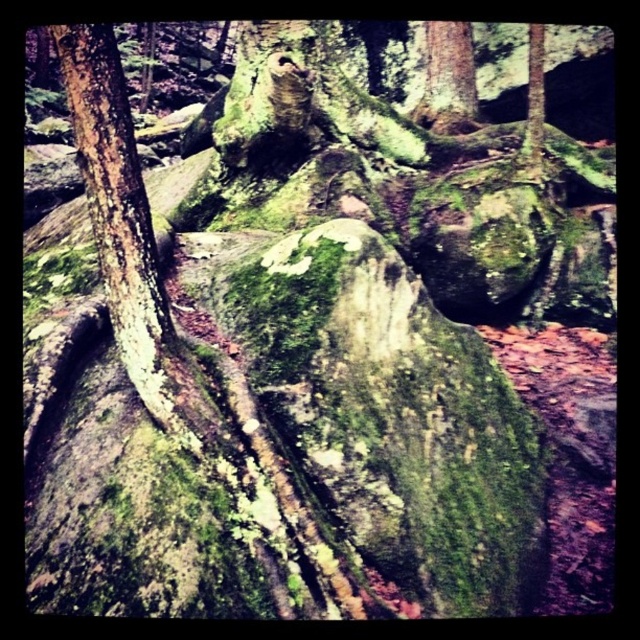
You are a hiker trying to navigate through the forest floor. You need to identify which of the two trees, the green mossy bark at left or the smooth bark tree at upper center, is taller to determine your path. Which tree is taller?

The green mossy bark at left is taller than the smooth bark tree at upper center, so you should choose the path around the taller tree to ensure there is enough clearance.

From the picture: You are a hiker trying to identify the smaller tree in the forest. You see the green mossy bark at left and the smooth bark tree at upper center. Which one is smaller?

The green mossy bark at left is smaller compared to the smooth bark tree at upper center, so the green mossy bark at left is the smaller one.

You are a botanist examining the forest floor. You need to locate the green mossy bark at left. Where exactly is it located in the image?

The green mossy bark at left is located at point (124, 225) in the image.